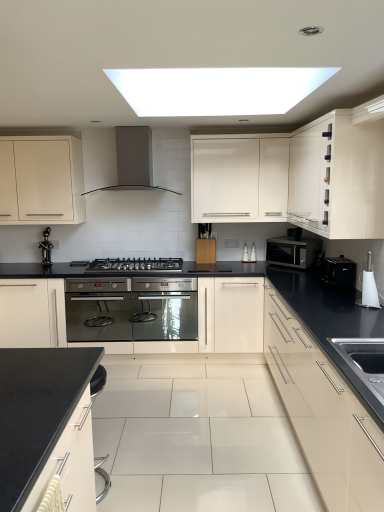
What is the approximate width of matte white cabinet at left, the 5th cabinetry in the right-to-left sequence?

It is 15.52 inches.

Locate an element on the screen. white glossy toilet brush at right, positioned as the 1th appliance in front-to-back order is located at coordinates (369, 288).

The height and width of the screenshot is (512, 384). Find the location of `black matte faucet at left`. black matte faucet at left is located at coordinates (46, 248).

Locate an element on the screen. The height and width of the screenshot is (512, 384). black matte countertop at lower left, acting as the 4th cabinetry starting from the right is located at coordinates (71, 463).

Where is `matte white cabinet at left, the 5th cabinetry in the right-to-left sequence`? The height and width of the screenshot is (512, 384). matte white cabinet at left, the 5th cabinetry in the right-to-left sequence is located at coordinates (41, 180).

Can you see white glossy cabinet at upper center, the third cabinetry in the left-to-right sequence, touching satin grey metal range hood at upper center?

No, white glossy cabinet at upper center, the third cabinetry in the left-to-right sequence, is not in contact with satin grey metal range hood at upper center.

Does white glossy cabinet at upper center, the third cabinetry in the left-to-right sequence, have a greater height compared to satin grey metal range hood at upper center?

Yes, white glossy cabinet at upper center, the third cabinetry in the left-to-right sequence, is taller than satin grey metal range hood at upper center.

Consider the image. Which is correct: white glossy cabinet at upper center, the third cabinetry in the right-to-left sequence, is inside satin grey metal range hood at upper center, or outside of it?

The correct answer is: outside.

Between black plastic toaster at right, placed as the second appliance when sorted from front to back, and black stainless steel gas stove at center, which one has smaller size?

Smaller between the two is black plastic toaster at right, placed as the second appliance when sorted from front to back.

Which object is positioned more to the left, black plastic toaster at right, the 1th appliance viewed from the back, or black stainless steel gas stove at center?

black stainless steel gas stove at center.

What's the angular difference between black plastic toaster at right, the 1th appliance viewed from the back, and black stainless steel gas stove at center's facing directions?

The angular difference between black plastic toaster at right, the 1th appliance viewed from the back, and black stainless steel gas stove at center is 91.3 degrees.

From the image's perspective, who appears lower, black plastic toaster at right, placed as the second appliance when sorted from front to back, or black stainless steel gas stove at center?

black plastic toaster at right, placed as the second appliance when sorted from front to back.

Which object is further away from the camera taking this photo, black stainless steel gas stove at center or black matte countertop at lower left, acting as the 4th cabinetry starting from the right?

black stainless steel gas stove at center is further away from the camera.

Is black stainless steel gas stove at center not within black matte countertop at lower left, the second cabinetry from the left?

black stainless steel gas stove at center is positioned outside black matte countertop at lower left, the second cabinetry from the left.

How different are the orientations of black stainless steel gas stove at center and black matte countertop at lower left, acting as the 4th cabinetry starting from the right, in degrees?

179 degrees.

From the picture: Would you say black stainless steel gas stove at center is a long distance from black matte countertop at lower left, acting as the 4th cabinetry starting from the right?

Yes, black stainless steel gas stove at center and black matte countertop at lower left, acting as the 4th cabinetry starting from the right, are located far from each other.

In the scene shown: Considering the sizes of objects satin grey metal range hood at upper center and glossy cream cabinet at right, the 4th cabinetry when ordered from left to right, in the image provided, who is smaller, satin grey metal range hood at upper center or glossy cream cabinet at right, the 4th cabinetry when ordered from left to right,?

Smaller between the two is satin grey metal range hood at upper center.

Which object is positioned more to the right, satin grey metal range hood at upper center or glossy cream cabinet at right, the 4th cabinetry when ordered from left to right?

From the viewer's perspective, glossy cream cabinet at right, the 4th cabinetry when ordered from left to right, appears more on the right side.

How different are the orientations of satin grey metal range hood at upper center and glossy cream cabinet at right, the 4th cabinetry when ordered from left to right, in degrees?

They differ by 90.6 degrees in their facing directions.

How far apart are black plastic toaster at right, the 1th appliance viewed from the back, and white glossy cabinet at upper center, the third cabinetry in the right-to-left sequence?

A distance of 3.53 feet exists between black plastic toaster at right, the 1th appliance viewed from the back, and white glossy cabinet at upper center, the third cabinetry in the right-to-left sequence.

Which point is more forward, (339, 256) or (235, 202)?

The point (339, 256) is closer.

From a real-world perspective, is black plastic toaster at right, placed as the second appliance when sorted from front to back, on white glossy cabinet at upper center, the third cabinetry in the right-to-left sequence?

No, from a real-world perspective, black plastic toaster at right, placed as the second appliance when sorted from front to back, is not above white glossy cabinet at upper center, the third cabinetry in the right-to-left sequence.

From their relative heights in the image, would you say black plastic toaster at right, the 1th appliance viewed from the back, is taller or shorter than white glossy cabinet at upper center, the third cabinetry in the left-to-right sequence?

Clearly, black plastic toaster at right, the 1th appliance viewed from the back, is shorter compared to white glossy cabinet at upper center, the third cabinetry in the left-to-right sequence.

Is black matte faucet at left inside or outside of glossy cream cabinet at right, which is counted as the 2th cabinetry, starting from the right?

black matte faucet at left is located beyond the bounds of glossy cream cabinet at right, which is counted as the 2th cabinetry, starting from the right.

Where is `faucet lying behind the glossy cream cabinet at right, the 4th cabinetry when ordered from left to right`? The image size is (384, 512). faucet lying behind the glossy cream cabinet at right, the 4th cabinetry when ordered from left to right is located at coordinates (46, 248).

Considering the points (42, 258) and (346, 400), which point is in front, point (42, 258) or point (346, 400)?

The point (346, 400) is closer to the camera.

Between black matte faucet at left and glossy cream cabinet at right, which is counted as the 2th cabinetry, starting from the right, which one has larger width?

glossy cream cabinet at right, which is counted as the 2th cabinetry, starting from the right.

Is the surface of black stainless steel gas stove at center in direct contact with white glossy toilet brush at right, positioned as the 1th appliance in front-to-back order?

No, black stainless steel gas stove at center is not with white glossy toilet brush at right, positioned as the 1th appliance in front-to-back order.

Considering the positions of objects black stainless steel gas stove at center and white glossy toilet brush at right, placed as the 2th appliance when sorted from back to front, in the image provided, who is more to the left, black stainless steel gas stove at center or white glossy toilet brush at right, placed as the 2th appliance when sorted from back to front,?

black stainless steel gas stove at center is more to the left.

Can you tell me how much black stainless steel gas stove at center and white glossy toilet brush at right, placed as the 2th appliance when sorted from back to front, differ in facing direction?

→ The facing directions of black stainless steel gas stove at center and white glossy toilet brush at right, placed as the 2th appliance when sorted from back to front, are 90.6 degrees apart.

Is white glossy toilet brush at right, placed as the 2th appliance when sorted from back to front, at the back of black stainless steel gas stove at center?

black stainless steel gas stove at center is not turned away from white glossy toilet brush at right, placed as the 2th appliance when sorted from back to front.

Find the location of a particular element. This screenshot has height=512, width=384. home appliance to the left of white glossy cabinet at upper center, the third cabinetry in the right-to-left sequence is located at coordinates (134, 160).

The width and height of the screenshot is (384, 512). There is a black stainless steel gas stove at center. Find the location of `the 1st appliance below it (from the image's perspective)`. the 1st appliance below it (from the image's perspective) is located at coordinates (339, 271).

Based on the photo, from the image, which object appears to be farther from white glossy cabinet at upper center, the third cabinetry in the right-to-left sequence, satin grey metal range hood at upper center or black plastic toaster at right, placed as the second appliance when sorted from front to back?

Among the two, black plastic toaster at right, placed as the second appliance when sorted from front to back, is located further to white glossy cabinet at upper center, the third cabinetry in the right-to-left sequence.

Based on their spatial positions, is black stainless steel gas stove at center or black plastic toaster at right, placed as the second appliance when sorted from front to back, further from glossy cream cabinet at right, which is counted as the 2th cabinetry, starting from the right?

The object further to glossy cream cabinet at right, which is counted as the 2th cabinetry, starting from the right, is black stainless steel gas stove at center.

Considering their positions, is satin black microwave at right positioned closer to black matte countertop at lower left, the second cabinetry from the left, than black matte faucet at left?

black matte faucet at left.

Which object lies further to the anchor point black matte faucet at left, black plastic toaster at right, placed as the second appliance when sorted from front to back, or black stainless steel gas stove at center?

Based on the image, black plastic toaster at right, placed as the second appliance when sorted from front to back, appears to be further to black matte faucet at left.

When comparing their distances from satin grey metal range hood at upper center, does glossy cream cabinet at right, the 4th cabinetry when ordered from left to right, or matte white cabinet at left, the 1th cabinetry positioned from the left, seem closer?

The object closer to satin grey metal range hood at upper center is matte white cabinet at left, the 1th cabinetry positioned from the left.

Looking at this image, based on their spatial positions, is white glossy cabinet at upper right, which is the 1th cabinetry from right to left, or white glossy cabinet at upper center, the third cabinetry in the right-to-left sequence, closer to matte white cabinet at left, the 1th cabinetry positioned from the left?

white glossy cabinet at upper center, the third cabinetry in the right-to-left sequence.

Which object lies nearer to the anchor point black plastic toaster at right, placed as the second appliance when sorted from front to back, matte white cabinet at left, the 5th cabinetry in the right-to-left sequence, or white glossy cabinet at upper center, the third cabinetry in the left-to-right sequence?

The object closer to black plastic toaster at right, placed as the second appliance when sorted from front to back, is white glossy cabinet at upper center, the third cabinetry in the left-to-right sequence.

Looking at the image, which one is located further to black matte faucet at left, satin grey metal range hood at upper center or white glossy cabinet at upper center, the third cabinetry in the right-to-left sequence?

Based on the image, white glossy cabinet at upper center, the third cabinetry in the right-to-left sequence, appears to be further to black matte faucet at left.

Locate an element on the screen. This screenshot has width=384, height=512. gas stove located between black matte faucet at left and white glossy cabinet at upper right, which is the 1th cabinetry from right to left, in the left-right direction is located at coordinates (135, 264).

Locate an element on the screen. The width and height of the screenshot is (384, 512). gas stove between black matte countertop at lower left, the second cabinetry from the left, and black matte faucet at left, along the z-axis is located at coordinates (135, 264).

Image resolution: width=384 pixels, height=512 pixels. I want to click on cabinetry between glossy cream cabinet at right, which is counted as the 2th cabinetry, starting from the right, and satin black microwave at right in the front-back direction, so click(338, 175).

Identify the location of kitchen appliance between black matte countertop at lower left, acting as the 4th cabinetry starting from the right, and black matte faucet at left from front to back. The height and width of the screenshot is (512, 384). (292, 251).